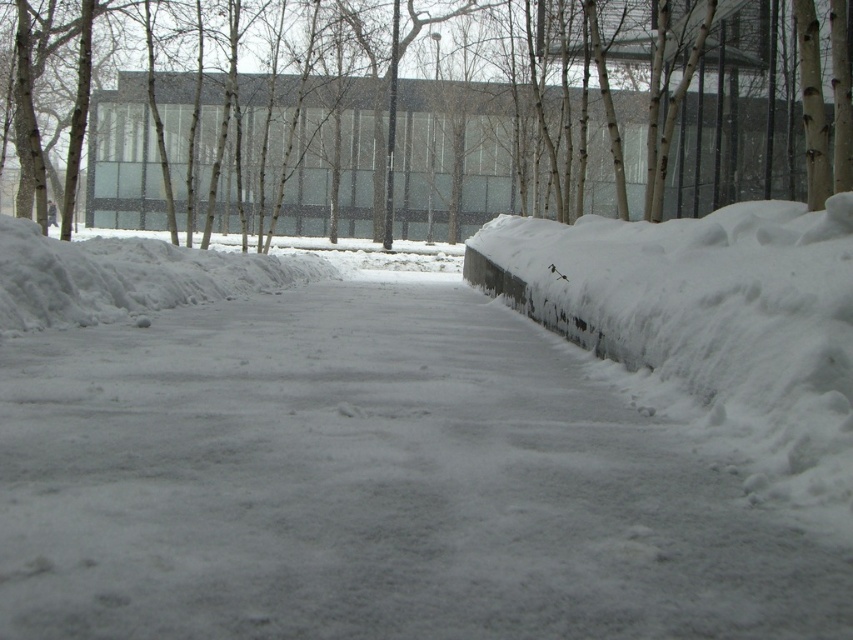
Is brown smooth tree at upper center bigger than white fluffy snow at right?

Yes, brown smooth tree at upper center is bigger than white fluffy snow at right.

Based on the photo, is brown smooth tree at upper center behind white fluffy snow at right?

Yes, brown smooth tree at upper center is further from the viewer.

The height and width of the screenshot is (640, 853). Identify the location of brown smooth tree at upper center. (473, 140).